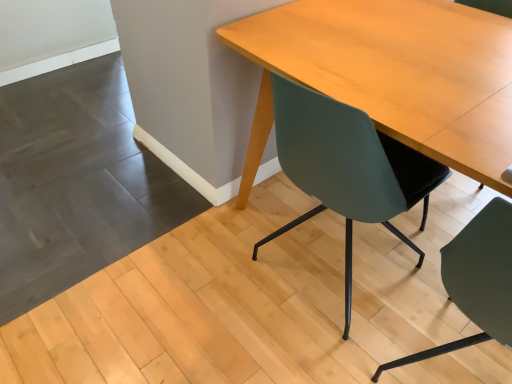
Find the location of `teal matte chair at center, the 1th chair in the right-to-left sequence`. teal matte chair at center, the 1th chair in the right-to-left sequence is located at coordinates (477, 280).

Considering the points (239, 24) and (313, 160), which point is in front, point (239, 24) or point (313, 160)?

Point (313, 160)

From the image's perspective, which is above, light wood table at center or teal matte chair at center, positioned as the 2th chair in right-to-left order?

light wood table at center.

I want to click on chair to the left of light wood table at center, so click(347, 167).

Looking at the image, does teal matte chair at center, the first chair from the left, seem bigger or smaller compared to light wood table at center?

Clearly, teal matte chair at center, the first chair from the left, is smaller in size than light wood table at center.

Is the depth of teal matte chair at center, the first chair from the left, greater than that of light wood table at center?

Yes, teal matte chair at center, the first chair from the left, is further from the viewer.

From a real-world perspective, is teal matte chair at center, positioned as the 2th chair in right-to-left order, above or below light wood table at center?

From a real-world perspective, teal matte chair at center, positioned as the 2th chair in right-to-left order, is physically above light wood table at center.

Is teal matte chair at center, the 1th chair in the right-to-left sequence, positioned beyond the bounds of teal matte chair at center, the first chair from the left?

Yes, teal matte chair at center, the 1th chair in the right-to-left sequence, is located beyond the bounds of teal matte chair at center, the first chair from the left.

From the image's perspective, is teal matte chair at center, acting as the second chair starting from the left, under teal matte chair at center, the first chair from the left?

Yes, from the image's perspective, teal matte chair at center, acting as the second chair starting from the left, is below teal matte chair at center, the first chair from the left.

From a real-world perspective, is teal matte chair at center, acting as the second chair starting from the left, positioned above or below teal matte chair at center, positioned as the 2th chair in right-to-left order?

From a real-world perspective, teal matte chair at center, acting as the second chair starting from the left, is physically above teal matte chair at center, positioned as the 2th chair in right-to-left order.

Could you measure the distance between teal matte chair at center, the 1th chair in the right-to-left sequence, and teal matte chair at center, positioned as the 2th chair in right-to-left order?

teal matte chair at center, the 1th chair in the right-to-left sequence, is 13.28 inches away from teal matte chair at center, positioned as the 2th chair in right-to-left order.

Who is bigger, teal matte chair at center, the first chair from the left, or teal matte chair at center, acting as the second chair starting from the left?

Bigger between the two is teal matte chair at center, the first chair from the left.

From the image's perspective, relative to teal matte chair at center, the 1th chair in the right-to-left sequence, is teal matte chair at center, the first chair from the left, above or below?

teal matte chair at center, the first chair from the left, is situated higher than teal matte chair at center, the 1th chair in the right-to-left sequence, in the image.

Is teal matte chair at center, positioned as the 2th chair in right-to-left order, not close to teal matte chair at center, acting as the second chair starting from the left?

No, there isn't a large distance between teal matte chair at center, positioned as the 2th chair in right-to-left order, and teal matte chair at center, acting as the second chair starting from the left.

Could you tell me if teal matte chair at center, positioned as the 2th chair in right-to-left order, is facing teal matte chair at center, the 1th chair in the right-to-left sequence?

No, teal matte chair at center, positioned as the 2th chair in right-to-left order, does not turn towards teal matte chair at center, the 1th chair in the right-to-left sequence.

In terms of width, does teal matte chair at center, the 1th chair in the right-to-left sequence, look wider or thinner when compared to light wood table at center?

Clearly, teal matte chair at center, the 1th chair in the right-to-left sequence, has less width compared to light wood table at center.

Is teal matte chair at center, the 1th chair in the right-to-left sequence, taller or shorter than light wood table at center?

teal matte chair at center, the 1th chair in the right-to-left sequence, is taller than light wood table at center.

Does teal matte chair at center, the 1th chair in the right-to-left sequence, touch light wood table at center?

No, teal matte chair at center, the 1th chair in the right-to-left sequence, is not making contact with light wood table at center.

From the image's perspective, is light wood table at center below teal matte chair at center, the 1th chair in the right-to-left sequence?

Actually, light wood table at center appears above teal matte chair at center, the 1th chair in the right-to-left sequence, in the image.

Considering the sizes of objects light wood table at center and teal matte chair at center, acting as the second chair starting from the left, in the image provided, who is bigger, light wood table at center or teal matte chair at center, acting as the second chair starting from the left,?

With larger size is light wood table at center.

Measure the distance from light wood table at center to teal matte chair at center, the 1th chair in the right-to-left sequence.

A distance of 22.17 inches exists between light wood table at center and teal matte chair at center, the 1th chair in the right-to-left sequence.

In the image, is light wood table at center on the left side or the right side of teal matte chair at center, acting as the second chair starting from the left?

light wood table at center is to the left of teal matte chair at center, acting as the second chair starting from the left.

You are a GUI agent. You are given a task and a screenshot of the screen. Output one action in this format:
    pyautogui.click(x=<x>, y=<y>)
    Task: Click on the table above the teal matte chair at center, the first chair from the left (from the image's perspective)
    The image size is (512, 384).
    Given the screenshot: What is the action you would take?
    pyautogui.click(x=392, y=75)

What are the coordinates of `table below the teal matte chair at center, the first chair from the left (from a real-world perspective)` in the screenshot? It's located at (392, 75).

Based on their spatial positions, is teal matte chair at center, positioned as the 2th chair in right-to-left order, or light wood table at center closer to teal matte chair at center, acting as the second chair starting from the left?

The object closer to teal matte chair at center, acting as the second chair starting from the left, is teal matte chair at center, positioned as the 2th chair in right-to-left order.

When comparing their distances from light wood table at center, does teal matte chair at center, positioned as the 2th chair in right-to-left order, or teal matte chair at center, the 1th chair in the right-to-left sequence, seem closer?

Among the two, teal matte chair at center, positioned as the 2th chair in right-to-left order, is located nearer to light wood table at center.

From the image, which object appears to be farther from teal matte chair at center, positioned as the 2th chair in right-to-left order, light wood table at center or teal matte chair at center, the 1th chair in the right-to-left sequence?

teal matte chair at center, the 1th chair in the right-to-left sequence.

From the image, which object appears to be farther from teal matte chair at center, acting as the second chair starting from the left, light wood table at center or teal matte chair at center, the first chair from the left?

Among the two, light wood table at center is located further to teal matte chair at center, acting as the second chair starting from the left.

From the image, which object appears to be nearer to teal matte chair at center, the first chair from the left, teal matte chair at center, the 1th chair in the right-to-left sequence, or light wood table at center?

light wood table at center.

Looking at the image, which one is located closer to light wood table at center, teal matte chair at center, acting as the second chair starting from the left, or teal matte chair at center, the first chair from the left?

The object closer to light wood table at center is teal matte chair at center, the first chair from the left.

This screenshot has height=384, width=512. What are the coordinates of `chair between light wood table at center and teal matte chair at center, the 1th chair in the right-to-left sequence, from top to bottom` in the screenshot? It's located at (347, 167).